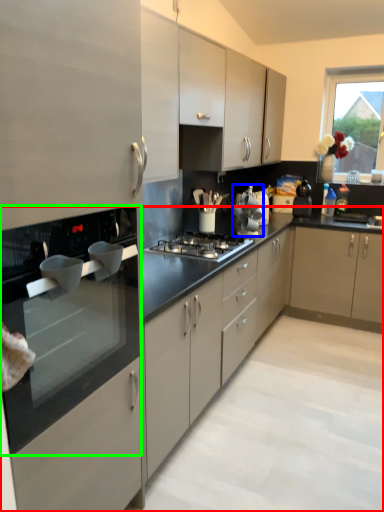
Question: Considering the real-world distances, which object is closest to countertop (highlighted by a red box)? appliance (highlighted by a blue box) or countertop (highlighted by a green box).

Choices:
 (A) appliance
 (B) countertop

Answer: (B)